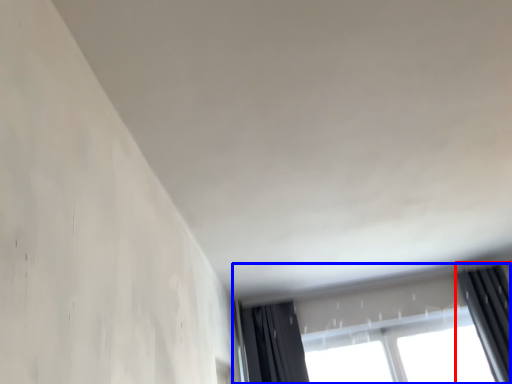
Question: Among these objects, which one is nearest to the camera, curtain (highlighted by a red box) or window (highlighted by a blue box)?

Choices:
 (A) curtain
 (B) window

Answer: (A)